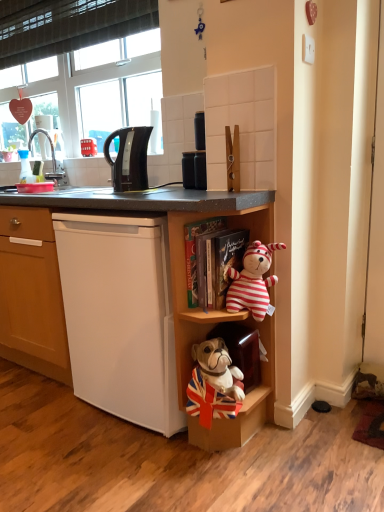
You are a GUI agent. You are given a task and a screenshot of the screen. Output one action in this format:
    pyautogui.click(x=<x>, y=<y>)
    Task: Click on the free space in front of white matte cabinet at lower right, which appears as the first cabinet when viewed from the left
    The image size is (384, 512).
    Given the screenshot: What is the action you would take?
    pyautogui.click(x=183, y=473)